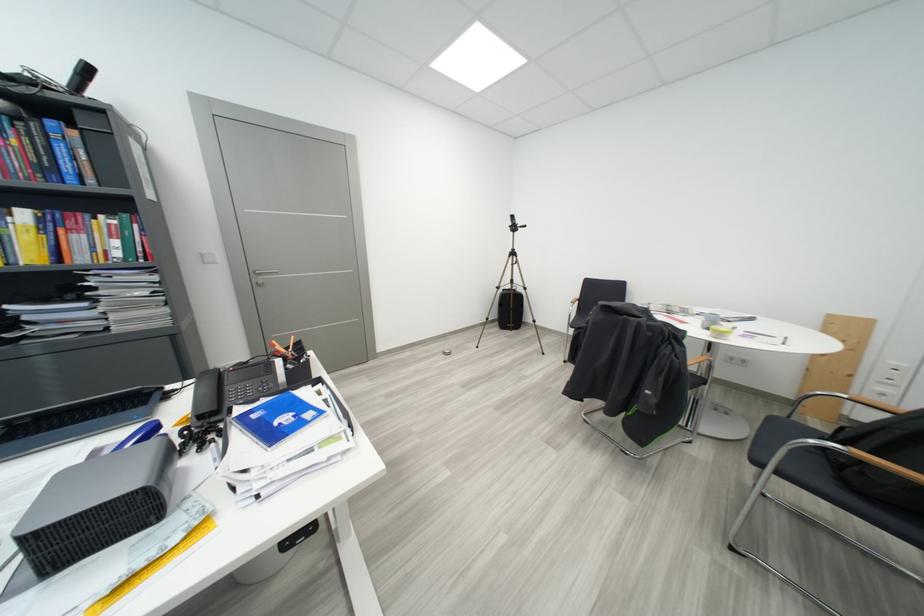
At what (x,y) coordinates should I click in order to perform the action: click on wooden chair armrest. Please return your answer as a coordinate pair (x, y). Looking at the image, I should click on (888, 476).